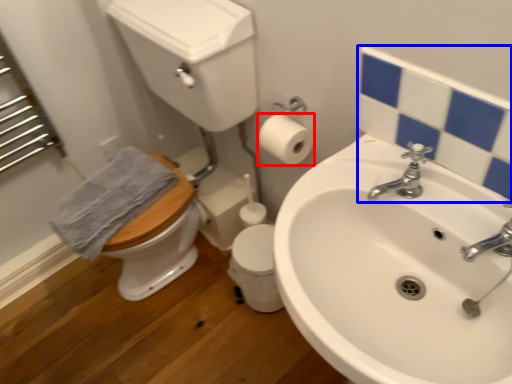
Question: Which of the following is the farthest to the observer, toilet paper (highlighted by a red box) or mirror (highlighted by a blue box)?

Choices:
 (A) toilet paper
 (B) mirror

Answer: (A)